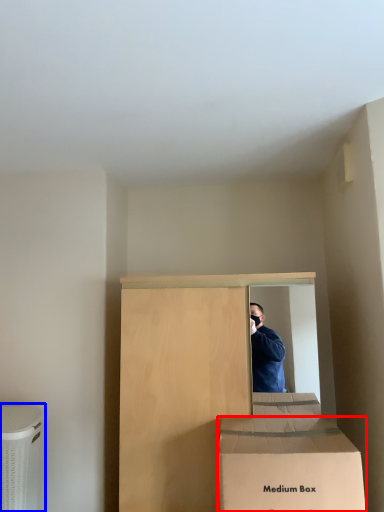
Question: Which point is further to the camera, box (highlighted by a red box) or cardboard box (highlighted by a blue box)?

Choices:
 (A) box
 (B) cardboard box

Answer: (B)